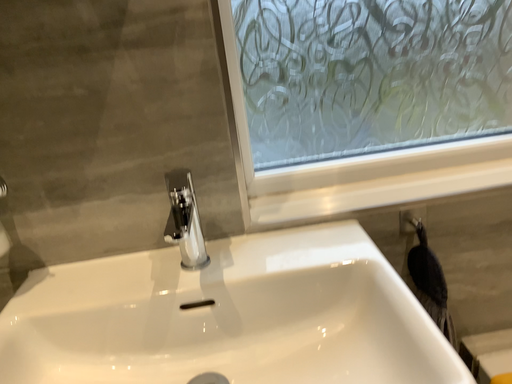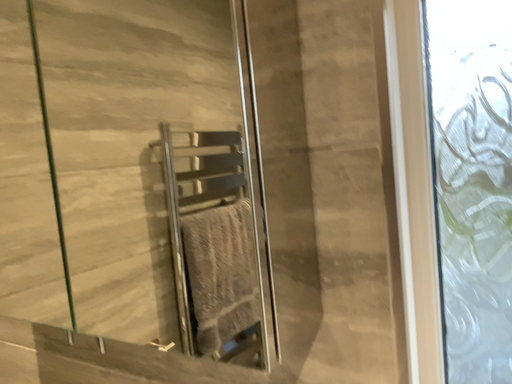
Question: Which way did the camera rotate in the video?

Choices:
 (A) rotated upward
 (B) rotated downward

Answer: (A)